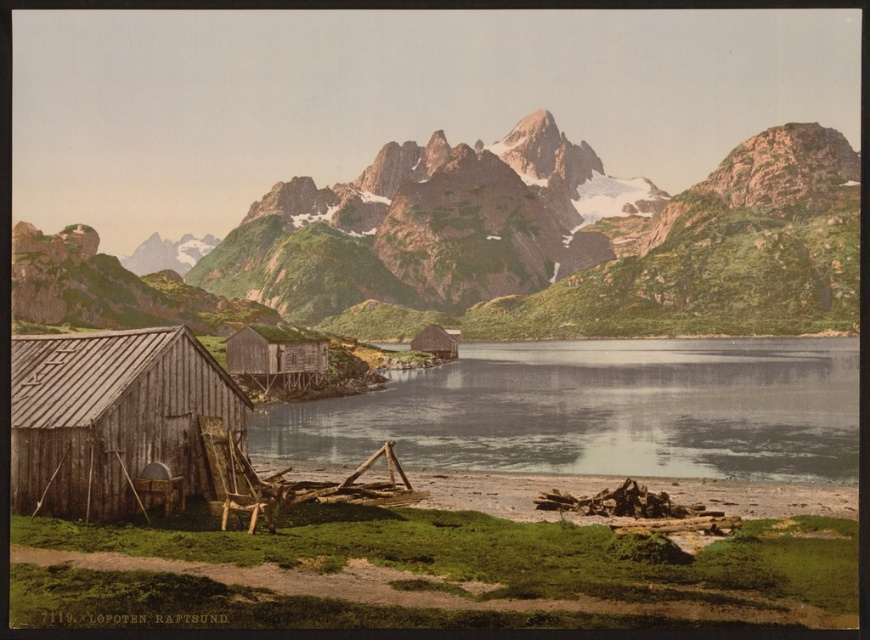
From the picture: Who is taller, rugged stone mountains at upper center or wooden cabin at center?

With more height is rugged stone mountains at upper center.

Does point (801, 304) come behind point (300, 358)?

Yes, it is.

This screenshot has width=870, height=640. What are the coordinates of `rugged stone mountains at upper center` in the screenshot? It's located at (503, 248).

Which of these two, wooden shack at lower left or wooden cabin at center, stands shorter?

wooden cabin at center is shorter.

Does wooden shack at lower left appear on the right side of wooden cabin at center?

No, wooden shack at lower left is not to the right of wooden cabin at center.

This screenshot has height=640, width=870. Describe the element at coordinates (110, 416) in the screenshot. I see `wooden shack at lower left` at that location.

The width and height of the screenshot is (870, 640). I want to click on wooden shack at lower left, so click(110, 416).

Can you confirm if wooden shack at lower left is thinner than brown wood logs at lower center?

Yes.

Consider the image. Is wooden shack at lower left shorter than brown wood logs at lower center?

No.

Where is `wooden shack at lower left`? Image resolution: width=870 pixels, height=640 pixels. wooden shack at lower left is located at coordinates (110, 416).